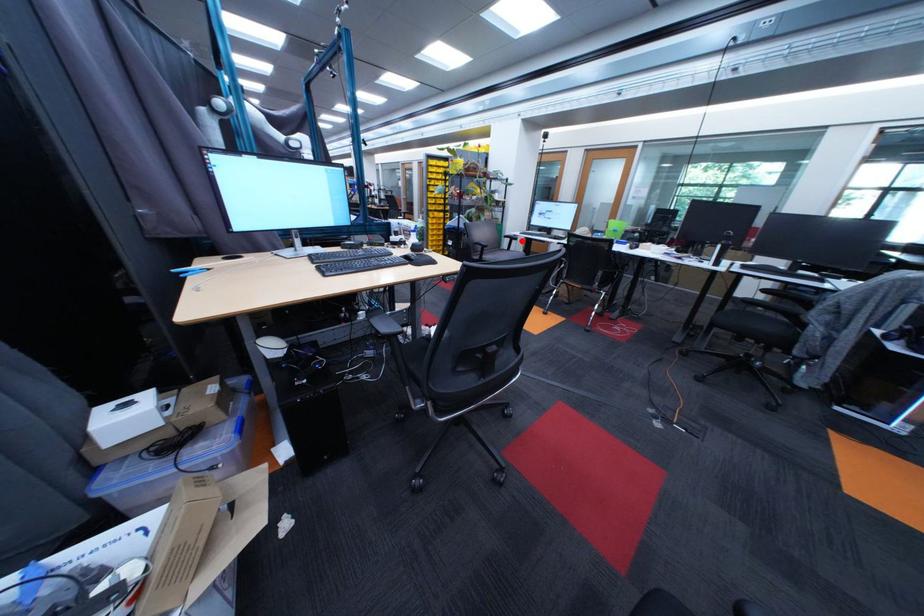
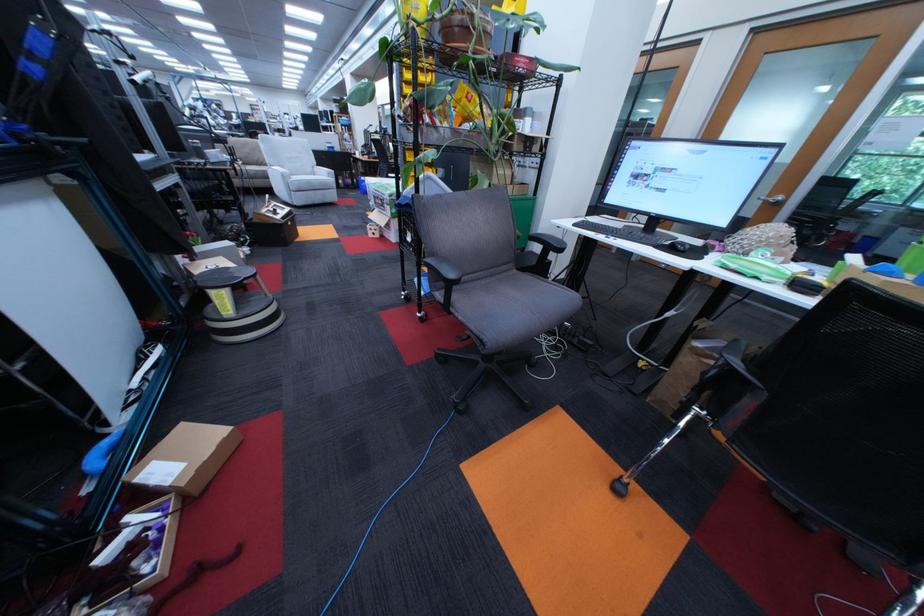
Question: I am providing you with two images of the same scene from different viewpoints. A red point is marked on the first image. Can you still see the location of the red point in image 2?

Choices:
 (A) Yes
 (B) No

Answer: (A)